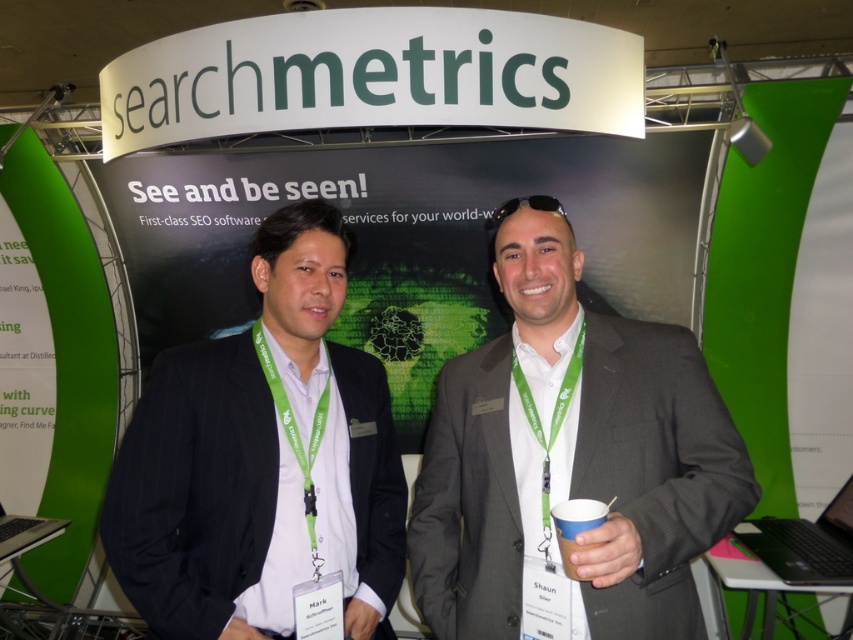
You are a photographer standing to the side of the booth. You want to take a photo of the dark gray pinstripe suit at center and the black plastic laptop at lower right without any obstructions. Based on their sizes, which object should be placed closer to the camera to ensure both are fully visible in the frame?

The dark gray pinstripe suit at center might be wider than the black plastic laptop at lower right, so placing the dark gray pinstripe suit at center closer to the camera would ensure both objects are fully visible in the frame without one blocking the other.

You are a visitor at the searchmetrics booth and want to interact with the black plastic laptop at lower right. However, there is a dark gray pinstripe suit at center blocking your path. Can you reach the laptop without moving the person wearing the suit?

The dark gray pinstripe suit at center is in front of the black plastic laptop at lower right, so you cannot reach the laptop without moving the person wearing the suit.

You are standing at the promotional booth for searchmetrics. You notice two points on the booth. The first point is at coordinate point (839,582) and the second point is at coordinate point (32,529). Which point is closer to you?

Point (839,582) is closer to the camera than point (32,529).